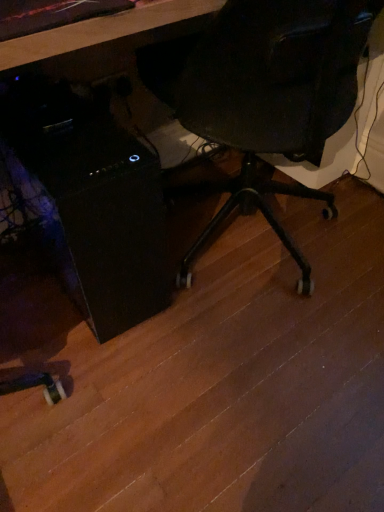
I want to click on black matte computer tower at lower left, so click(97, 206).

The width and height of the screenshot is (384, 512). Describe the element at coordinates (97, 206) in the screenshot. I see `black matte computer tower at lower left` at that location.

Locate an element on the screen. This screenshot has width=384, height=512. black matte computer tower at lower left is located at coordinates (97, 206).